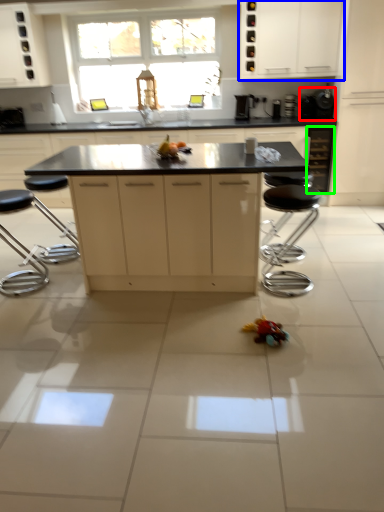
Question: Estimate the real-world distances between objects in this image. Which object is farther from appliance (highlighted by a red box), cabinetry (highlighted by a blue box) or cabinetry (highlighted by a green box)?

Choices:
 (A) cabinetry
 (B) cabinetry

Answer: (A)